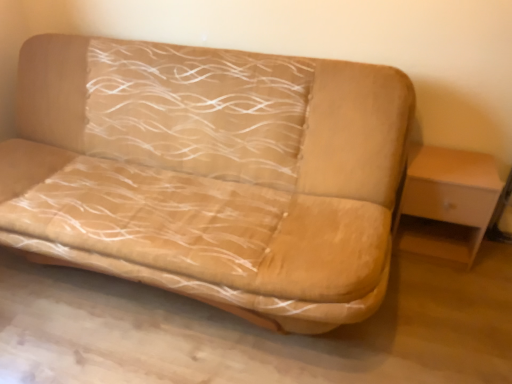
Question: Is beige fabric couch at center facing towards light wood/wooden table at right?

Choices:
 (A) no
 (B) yes

Answer: (A)

Question: From the image's perspective, would you say beige fabric couch at center is shown under light wood/wooden table at right?

Choices:
 (A) yes
 (B) no

Answer: (B)

Question: Is light wood/wooden table at right at the back of beige fabric couch at center?

Choices:
 (A) no
 (B) yes

Answer: (A)

Question: Can you confirm if beige fabric couch at center is positioned to the right of light wood/wooden table at right?

Choices:
 (A) no
 (B) yes

Answer: (A)

Question: Can you confirm if beige fabric couch at center is wider than light wood/wooden table at right?

Choices:
 (A) yes
 (B) no

Answer: (A)

Question: Can you confirm if beige fabric couch at center is smaller than light wood/wooden table at right?

Choices:
 (A) no
 (B) yes

Answer: (A)

Question: Can you confirm if light wood/wooden table at right is shorter than beige fabric couch at center?

Choices:
 (A) no
 (B) yes

Answer: (B)

Question: Is light wood/wooden table at right placed right next to beige fabric couch at center?

Choices:
 (A) yes
 (B) no

Answer: (B)

Question: Considering the relative sizes of light wood/wooden table at right and beige fabric couch at center in the image provided, is light wood/wooden table at right wider than beige fabric couch at center?

Choices:
 (A) no
 (B) yes

Answer: (A)

Question: Considering the relative sizes of light wood/wooden table at right and beige fabric couch at center in the image provided, is light wood/wooden table at right smaller than beige fabric couch at center?

Choices:
 (A) yes
 (B) no

Answer: (A)

Question: Can you confirm if light wood/wooden table at right is bigger than beige fabric couch at center?

Choices:
 (A) yes
 (B) no

Answer: (B)

Question: Is light wood/wooden table at right positioned with its back to beige fabric couch at center?

Choices:
 (A) yes
 (B) no

Answer: (B)

Question: Based on their positions, is light wood/wooden table at right located to the left or right of beige fabric couch at center?

Choices:
 (A) right
 (B) left

Answer: (A)